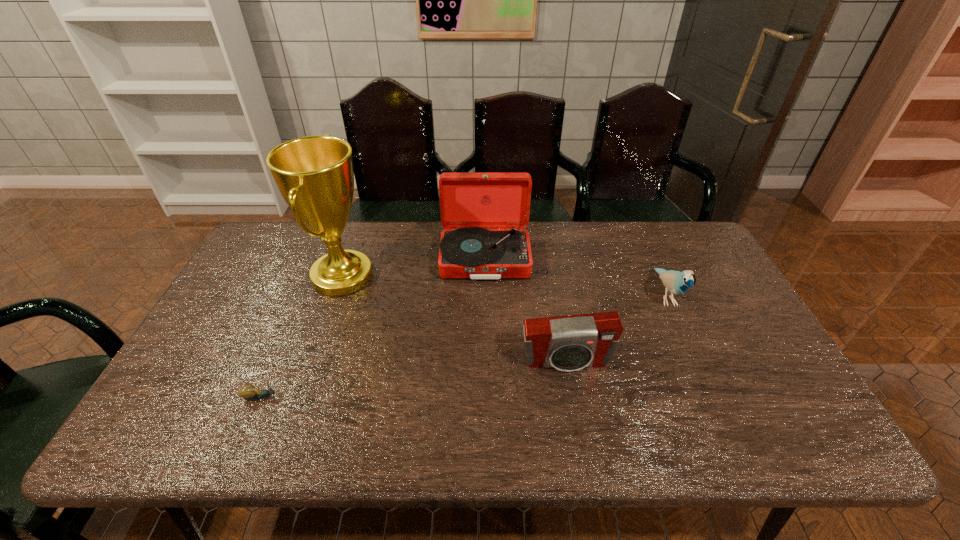
Find the location of a particular element. Image resolution: width=960 pixels, height=540 pixels. vacant region that satisfies the following two spatial constraints: 1. at the face of the rightmost object; 2. on the front-facing side of the nearest object is located at coordinates (711, 397).

Locate an element on the screen. vacant space that satisfies the following two spatial constraints: 1. on the front-facing side of the phonograph_record; 2. by the handles of the tallest object is located at coordinates (485, 276).

Identify the location of free space in the image that satisfies the following two spatial constraints: 1. on the front-facing side of the second nearest object; 2. on the front-facing side of the nearest object. The image size is (960, 540). (572, 397).

Locate an element on the screen. This screenshot has height=540, width=960. free location that satisfies the following two spatial constraints: 1. at the face of the bird; 2. on the front-facing side of the escargot is located at coordinates (711, 397).